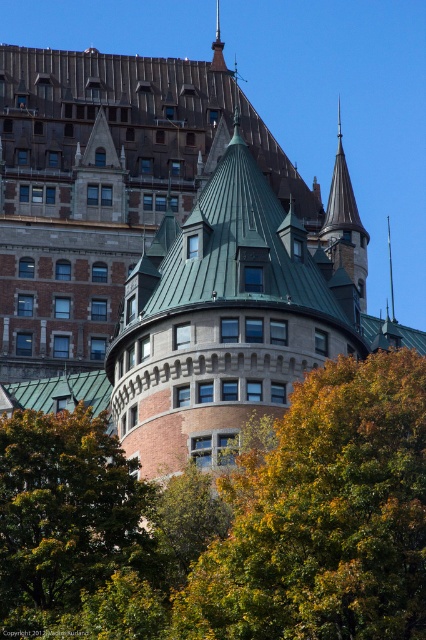
Does brown stone tower at center come in front of green leafy tree at lower left?

No, brown stone tower at center is behind green leafy tree at lower left.

Who is more forward, (316, 266) or (138, 600)?

Point (138, 600)

Locate an element on the screen. This screenshot has width=426, height=640. brown stone tower at center is located at coordinates (222, 321).

The width and height of the screenshot is (426, 640). Identify the location of brown stone tower at center. (222, 321).

Can you confirm if green leafy tree at center is taller than brown stone tower at center?

No.

Is point (371, 465) more distant than point (169, 467)?

No, it is in front of (169, 467).

Does point (350, 480) lie in front of point (276, 296)?

Yes.

Where is `green leafy tree at center`? green leafy tree at center is located at coordinates point(324,516).

Who is more distant from viewer, (284, 634) or (34, 472)?

The point (34, 472) is more distant.

Identify the location of green leafy tree at center. (324, 516).